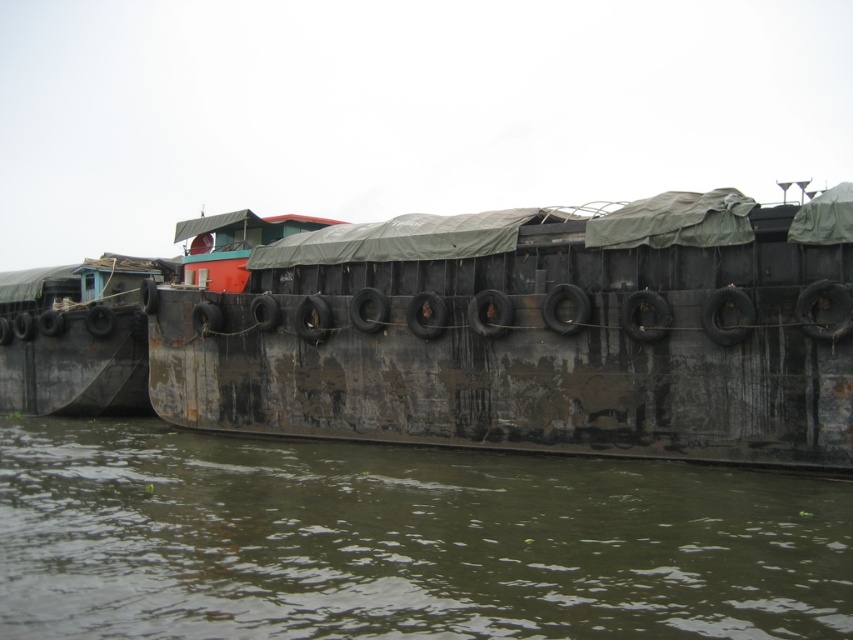
You are a sailor who needs to navigate a small boat through the river. The river has the brown murky water at lower center and the rusty metal barge at left. Which area should you avoid to prevent getting stuck?

You should avoid the brown murky water at lower center because its width surpasses the rusty metal barge at left, indicating it might have deeper or safer passage.

You are a delivery person who needs to cross from the rusty metal barge at left to the dock on the other side of the brown murky water at lower center. The distance between them is crucial for your boat. Can you safely navigate a boat that requires at least 10 meters of clearance between the barge and the dock?

The brown murky water at lower center and the rusty metal barge at left are 12.50 meters apart from each other. Since the required clearance is at least 10 meters, the boat can safely navigate the distance between them.

Consider the image. You are a crane operator tasked with moving cargo between two rusty metal barges. The rusty metal barge at center and the rusty metal barge at left are both docked along the riverbank. Given that your crane has a maximum reach of 10 meters, can you transfer cargo directly between them without moving the crane?

The rusty metal barge at center and the rusty metal barge at left are 10.05 meters apart from each other. Since the crane has a maximum reach of 10 meters, the distance is slightly beyond its capacity. Therefore, you cannot transfer cargo directly between them without moving the crane.